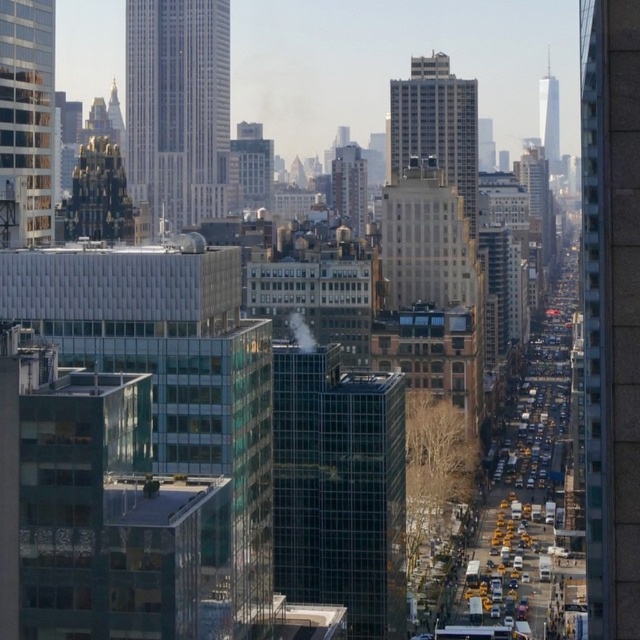
Who is taller, white glass skyscraper at upper left or white glass tower at upper right?

white glass skyscraper at upper left is taller.

Does white glass skyscraper at upper left have a lesser height compared to white glass tower at upper right?

In fact, white glass skyscraper at upper left may be taller than white glass tower at upper right.

The height and width of the screenshot is (640, 640). Find the location of `white glass skyscraper at upper left`. white glass skyscraper at upper left is located at coordinates (177, 108).

Image resolution: width=640 pixels, height=640 pixels. What are the coordinates of `white glass skyscraper at upper left` in the screenshot? It's located at (177, 108).

Does brick textured building at right have a lesser height compared to white glass skyscraper at upper left?

No.

Is point (612, 182) behind point (188, 92)?

That is False.

This screenshot has height=640, width=640. In order to click on brick textured building at right in this screenshot , I will do `click(611, 310)`.

Is brick building at center closer to camera compared to white glass tower at upper right?

Yes, it is.

Is brick building at center below white glass tower at upper right?

Correct, brick building at center is located below white glass tower at upper right.

You are a GUI agent. You are given a task and a screenshot of the screen. Output one action in this format:
    pyautogui.click(x=<x>, y=<y>)
    Task: Click on the brick building at center
    
    Given the screenshot: What is the action you would take?
    pyautogui.click(x=349, y=188)